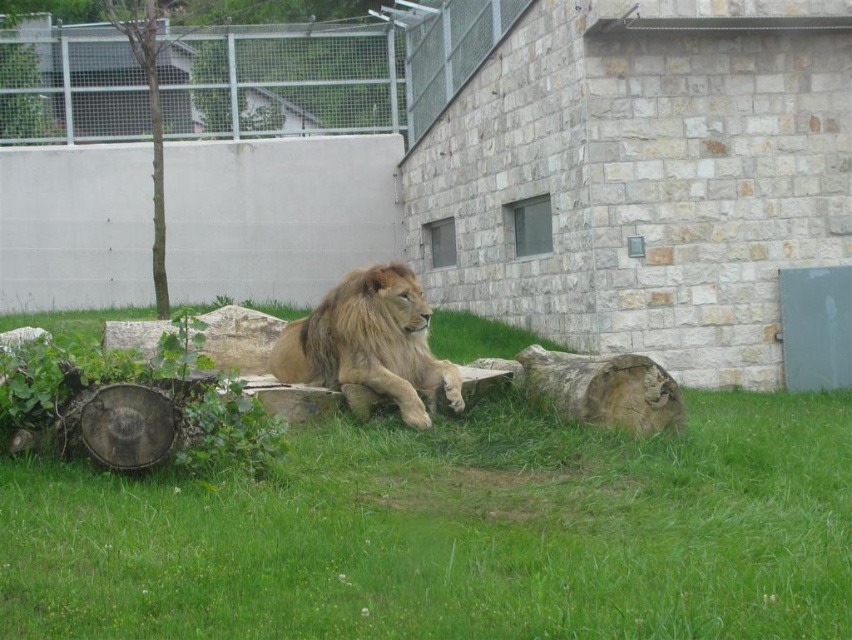
Does golden fur lion at center lie behind green bark tree at upper left?

No, it is not.

Can you confirm if golden fur lion at center is positioned below green bark tree at upper left?

Yes, golden fur lion at center is below green bark tree at upper left.

The width and height of the screenshot is (852, 640). What do you see at coordinates (370, 342) in the screenshot?
I see `golden fur lion at center` at bounding box center [370, 342].

Identify the location of golden fur lion at center. (370, 342).

Is green grass at center thinner than green bark tree at upper left?

Yes, green grass at center is thinner than green bark tree at upper left.

Is green grass at center positioned behind green bark tree at upper left?

No, it is not.

Which is in front, point (228, 544) or point (151, 164)?

Positioned in front is point (228, 544).

Find the location of `green grass at center`. green grass at center is located at coordinates (455, 532).

In the scene shown: Who is positioned more to the right, green grass at center or golden fur lion at center?

green grass at center is more to the right.

Is point (479, 497) closer to camera compared to point (306, 384)?

Yes, it is in front of point (306, 384).

Find the location of `green grass at center`. green grass at center is located at coordinates (455, 532).